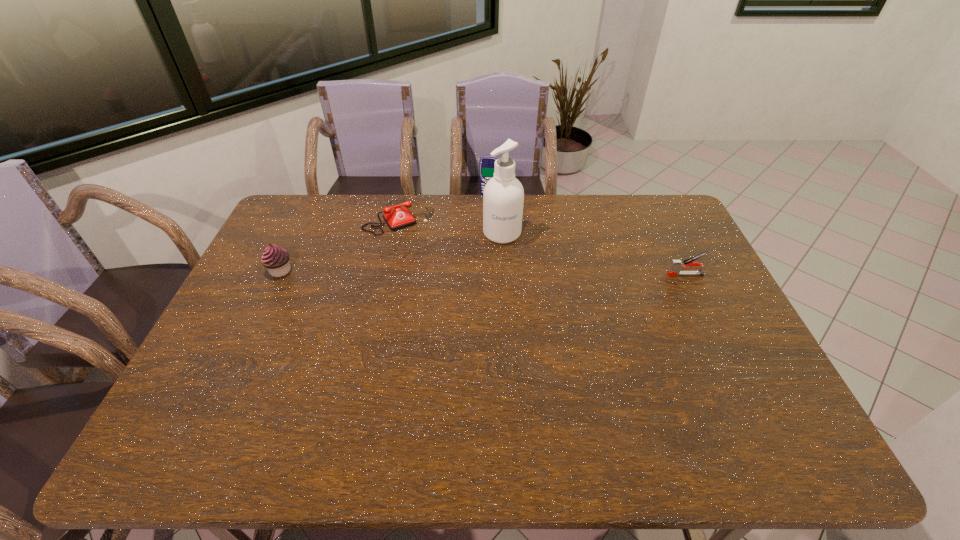
Where is `vacant space situated 0.330m on the handle side of the rightmost object`? This screenshot has width=960, height=540. vacant space situated 0.330m on the handle side of the rightmost object is located at coordinates (563, 274).

What are the coordinates of `vacant space situated on the handle side of the rightmost object` in the screenshot? It's located at (550, 274).

Identify the location of vacant region located on the handle side of the rightmost object. (630, 274).

The width and height of the screenshot is (960, 540). In order to click on vacant area located on the dial of the telephone in this screenshot , I will do `click(421, 249)`.

This screenshot has height=540, width=960. Identify the location of blank space located 0.230m on the dial of the telephone. (439, 275).

This screenshot has height=540, width=960. Identify the location of vacant space located 0.050m on the dial of the telephone. (418, 243).

Where is `vacant area situated on the front label of the tallest object`? This screenshot has width=960, height=540. vacant area situated on the front label of the tallest object is located at coordinates (514, 317).

At what (x,y) coordinates should I click in order to perform the action: click on vacant space located on the front label of the tallest object. Please return your answer as a coordinate pair (x, y). This screenshot has height=540, width=960. Looking at the image, I should click on (514, 320).

Find the location of a particular element. free region located 0.070m on the front label of the tallest object is located at coordinates (506, 259).

Where is `vacant space located 0.290m on the front-facing side of the cellular telephone`? vacant space located 0.290m on the front-facing side of the cellular telephone is located at coordinates (476, 245).